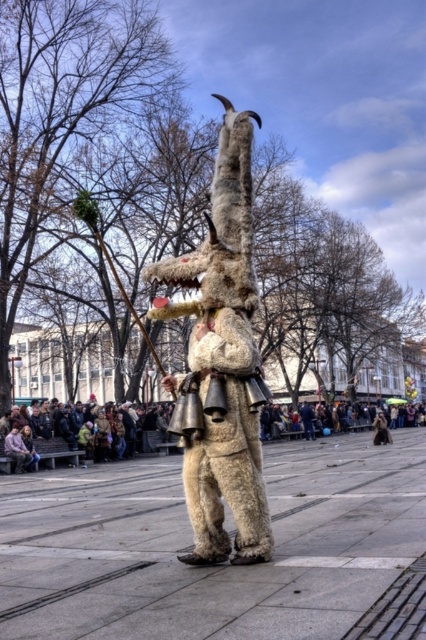
You are a delivery robot navigating through the public square. You need to deliver a package to the mythical creature costume at the center. There is a smooth concrete pavement at center and a brown fabric crowd at lower left in your path. Which object should you avoid to reach the creature safely?

You should avoid the brown fabric crowd at lower left because the smooth concrete pavement at center is on its right side, so moving along the smooth concrete pavement at center would allow you to reach the creature safely without encountering the crowd.

You are a photographer standing in the public square and want to take a photo of the mythical creature costume. You notice two points marked on your camera screen at coordinates point (391, 449) and point (222, 419). Which point is closer to the camera?

Point (222, 419) is closer to the camera than point (391, 449).